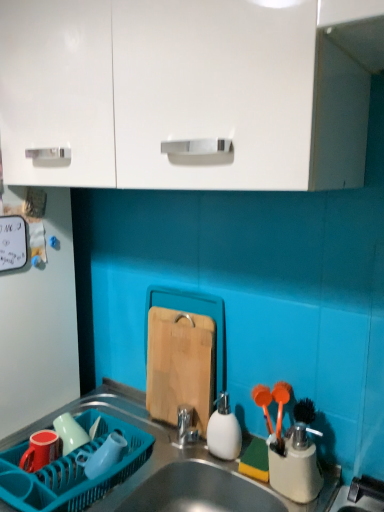
Where is `free space behind matte green cup at left, which is the third tableware in right-to-left order`? free space behind matte green cup at left, which is the third tableware in right-to-left order is located at coordinates (104, 416).